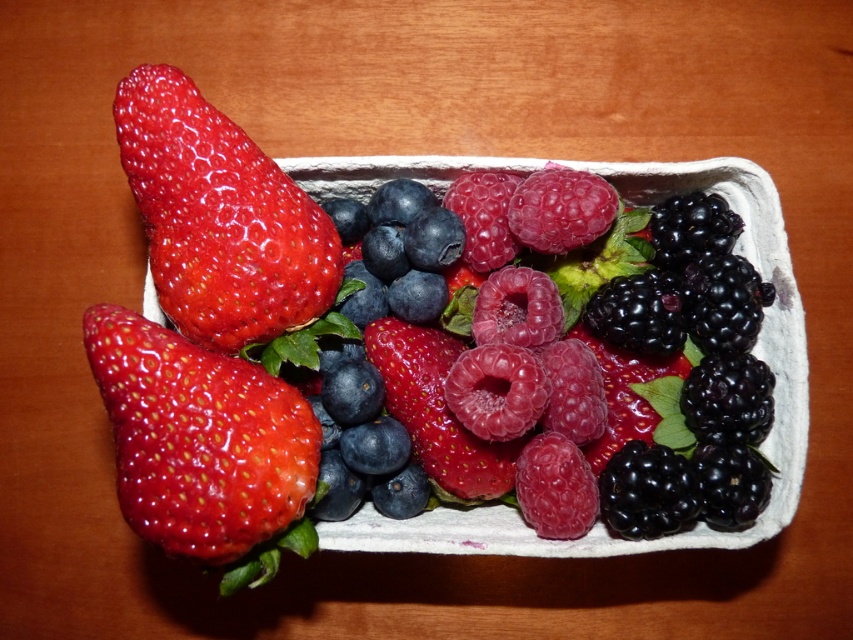
Question: Which point is closer to the camera?

Choices:
 (A) shiny red strawberry at lower left
 (B) glossy red strawberry at center
 (C) shiny red strawberry at upper left

Answer: (A)

Question: Among these points, which one is nearest to the camera?

Choices:
 (A) (190, 449)
 (B) (393, 381)
 (C) (242, 195)

Answer: (A)

Question: Does shiny red strawberry at upper left come behind glossy red strawberry at center?

Choices:
 (A) yes
 (B) no

Answer: (B)

Question: Which object appears closest to the camera in this image?

Choices:
 (A) shiny red strawberry at lower left
 (B) shiny red strawberry at upper left

Answer: (A)

Question: Does shiny red strawberry at lower left come behind glossy red strawberry at center?

Choices:
 (A) yes
 (B) no

Answer: (B)

Question: Is shiny red strawberry at lower left below glossy red strawberry at center?

Choices:
 (A) yes
 (B) no

Answer: (A)